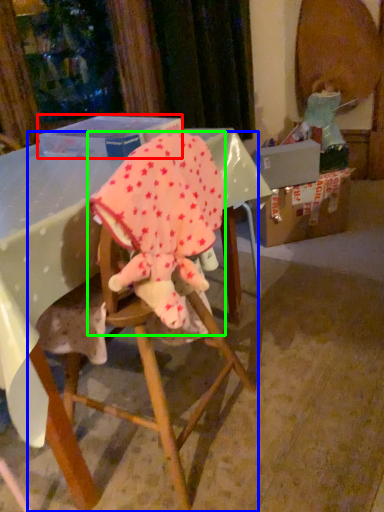
Question: Considering the real-world distances, which object is closest to box (highlighted by a red box)? chair (highlighted by a blue box) or baby elephant (highlighted by a green box).

Choices:
 (A) chair
 (B) baby elephant

Answer: (B)